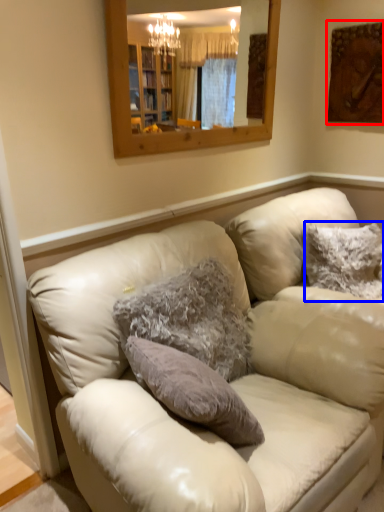
Question: Which point is further to the camera, picture frame (highlighted by a red box) or pillow (highlighted by a blue box)?

Choices:
 (A) picture frame
 (B) pillow

Answer: (A)